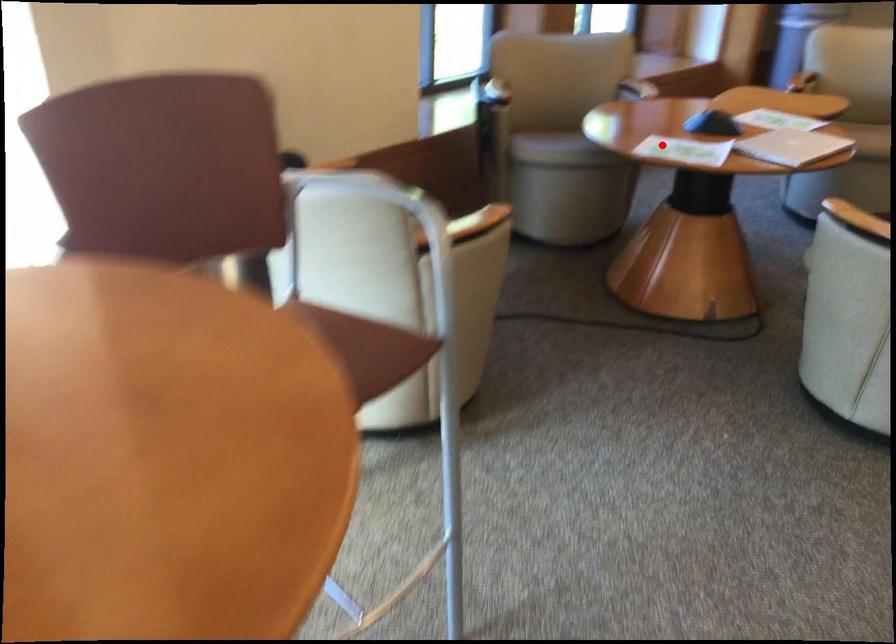
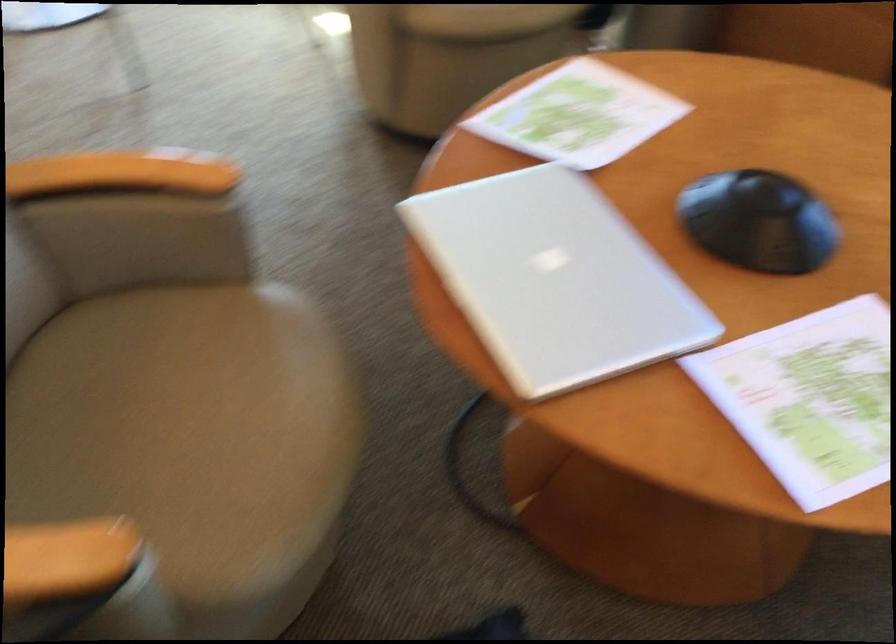
Find the pixel in the second image that matches the highlighted location in the first image.

(579, 115)